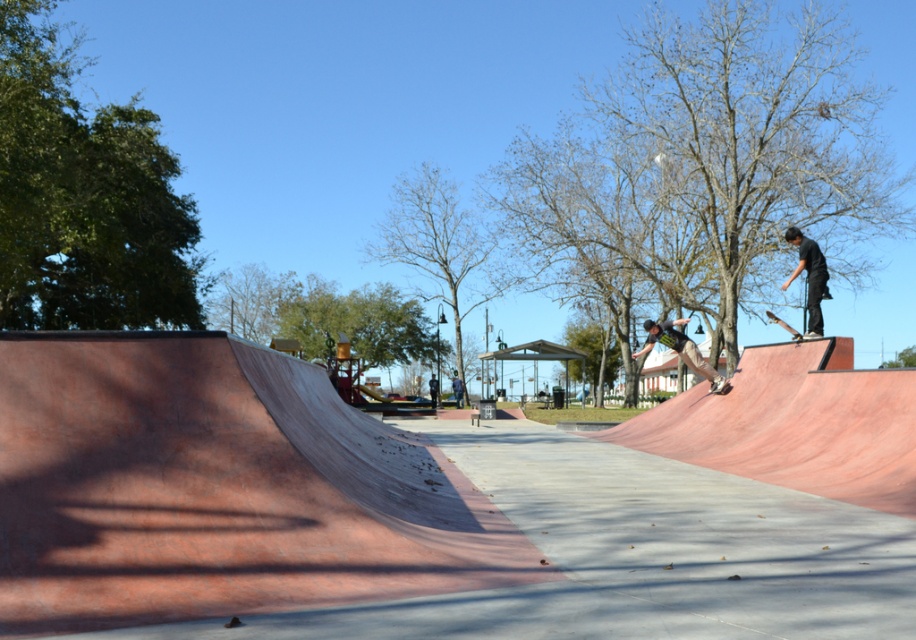
Is black matte skateboarder at right further to camera compared to metallic silver skateboard at center?

No.

Consider the image. Is black matte skateboarder at right closer to the viewer compared to metallic silver skateboard at center?

Yes, it is in front of metallic silver skateboard at center.

Which is behind, point (807, 237) or point (720, 388)?

Positioned behind is point (720, 388).

I want to click on black matte skateboarder at right, so click(x=809, y=276).

Between smooth red ramp at right and metallic silver skateboard at center, which one is positioned higher?

metallic silver skateboard at center is higher up.

Is point (909, 426) positioned in front of point (722, 384)?

Yes, it is.

What do you see at coordinates (795, 424) in the screenshot? I see `smooth red ramp at right` at bounding box center [795, 424].

The height and width of the screenshot is (640, 916). Find the location of `smooth red ramp at right`. smooth red ramp at right is located at coordinates (795, 424).

Does smooth concrete ramp at center lie behind black matte skateboarder at right?

No, smooth concrete ramp at center is closer to the viewer.

Is smooth concrete ramp at center smaller than black matte skateboarder at right?

No, smooth concrete ramp at center is not smaller than black matte skateboarder at right.

Between point (365, 435) and point (815, 330), which one is positioned in front?

Point (365, 435) is in front.

Locate an element on the screen. This screenshot has width=916, height=640. smooth concrete ramp at center is located at coordinates (386, 515).